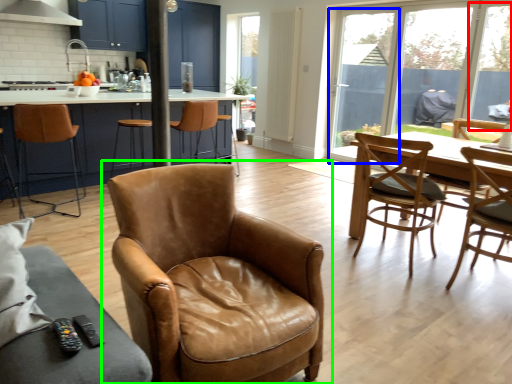
Question: Which object is the farthest from window screen (highlighted by a red box)? Choose among these: window screen (highlighted by a blue box) or chair (highlighted by a green box).

Choices:
 (A) window screen
 (B) chair

Answer: (B)